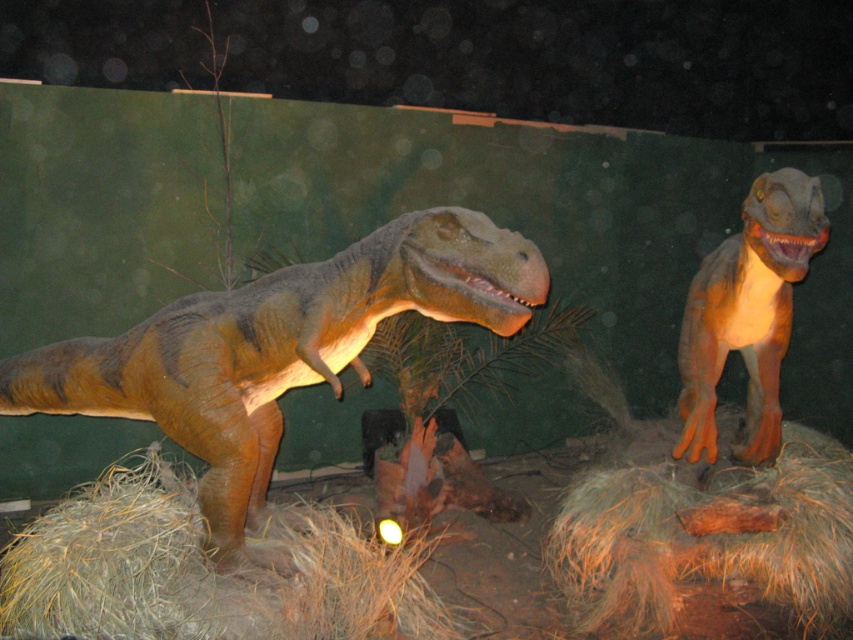
Question: Is brown fibrous hay at right smaller than brown straw at lower left?

Choices:
 (A) yes
 (B) no

Answer: (B)

Question: Among these points, which one is nearest to the camera?

Choices:
 (A) (650, 556)
 (B) (785, 316)
 (C) (515, 272)
 (D) (422, 621)

Answer: (C)

Question: Is matte brown dinosaur at left thinner than brown fibrous hay at right?

Choices:
 (A) no
 (B) yes

Answer: (A)

Question: Among these objects, which one is farthest from the camera?

Choices:
 (A) matte brown dinosaur at left
 (B) brown fibrous hay at right

Answer: (B)

Question: In this image, where is brown fibrous hay at right located relative to orange matte dinosaur at right?

Choices:
 (A) right
 (B) left

Answer: (B)

Question: Which point is closer to the camera?

Choices:
 (A) (801, 212)
 (B) (639, 486)
 (C) (198, 548)
 (D) (532, 266)

Answer: (D)